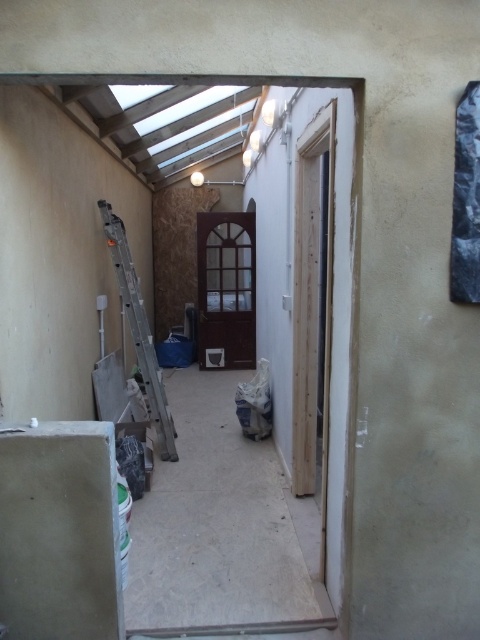
Question: Can you confirm if brown wooden door at center is positioned below silver metallic ladder at left?

Choices:
 (A) yes
 (B) no

Answer: (B)

Question: Is brown wooden door at center closer to the viewer compared to silver metallic ladder at left?

Choices:
 (A) yes
 (B) no

Answer: (B)

Question: Is brown wooden door at center smaller than silver metallic ladder at left?

Choices:
 (A) yes
 (B) no

Answer: (B)